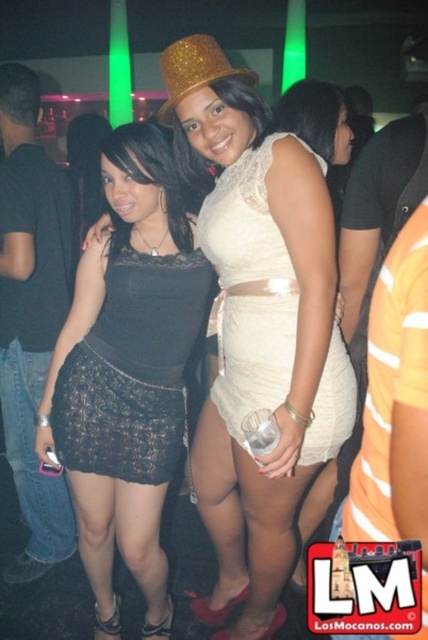
You are at a party and want to take a photo of both the black lace skirt at center and the black lace skirt at left without any obstruction. Given that your camera has a maximum focus range of 2.5 inches, will you be able to capture both skirts in focus?

The black lace skirt at center and the black lace skirt at left are 2.79 inches apart, which exceeds the camera maximum focus range of 2.5 inches. Therefore, you cannot capture both skirts in focus.

You are a photographer at a party who wants to take a photo of the matte white dress at center without the black lace skirt at left blocking it. What should you do?

Move the matte white dress at center forward so it is no longer behind the black lace skirt at left.